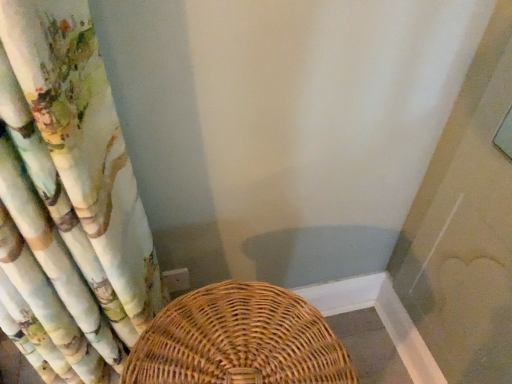
What is the approximate width of woven brown basket at lower center?

The width of woven brown basket at lower center is 11.01 inches.

This screenshot has width=512, height=384. What do you see at coordinates (239, 340) in the screenshot?
I see `woven brown basket at lower center` at bounding box center [239, 340].

What is the approximate height of woven brown basket at lower center?

22.43 inches.

At what (x,y) coordinates should I click in order to perform the action: click on woven brown basket at lower center. Please return your answer as a coordinate pair (x, y). Looking at the image, I should click on tap(239, 340).

Where is `woven brown basket at lower center`? This screenshot has height=384, width=512. woven brown basket at lower center is located at coordinates (239, 340).